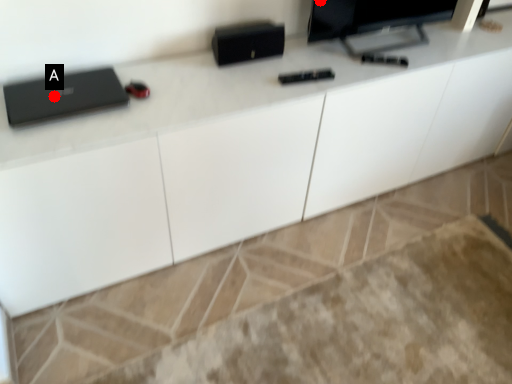
Question: Two points are circled on the image, labeled by A and B beside each circle. Which of the following is the closest to the observer?

Choices:
 (A) A is closer
 (B) B is closer

Answer: (A)